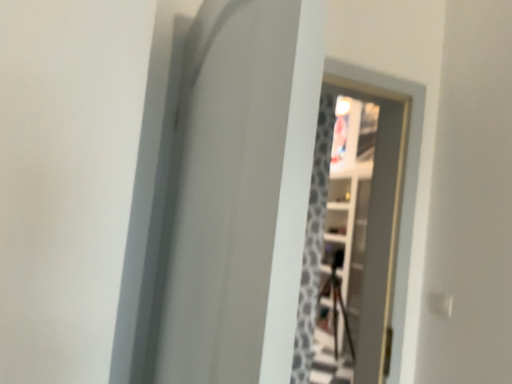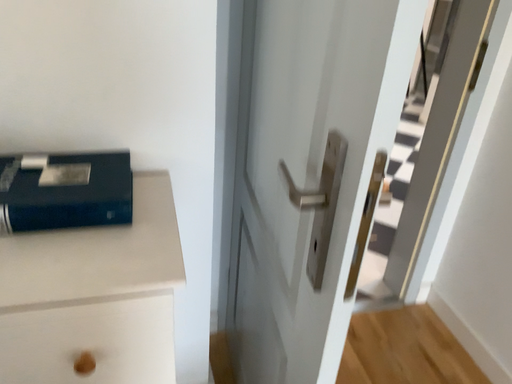
Question: Which way did the camera rotate in the video?

Choices:
 (A) rotated downward
 (B) rotated upward

Answer: (A)